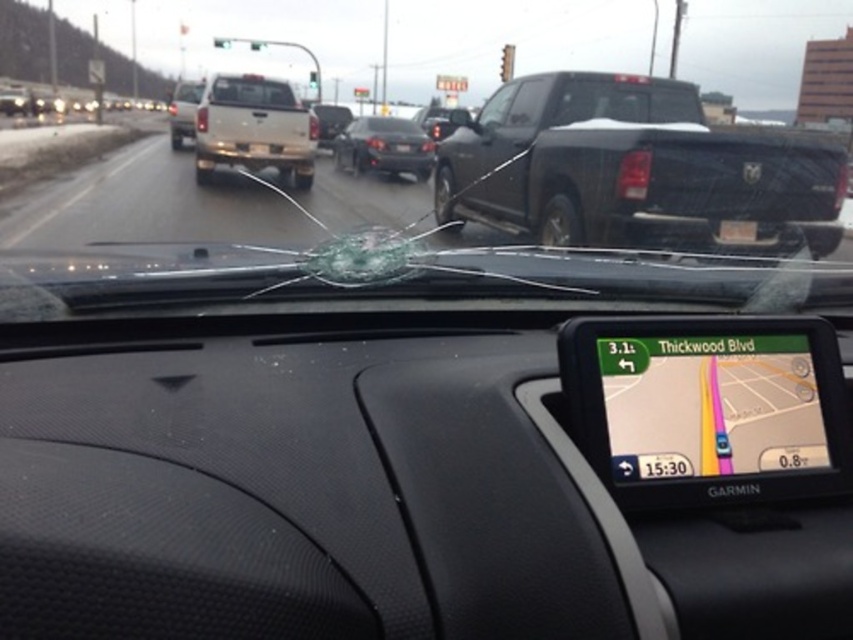
Looking at this image, you are driving and looking at the GPS device on the dashboard. You notice two points marked on the windshield. Which point is closer to you, the driver, between the point at coordinates (233, 148) and the point at coordinates (366, 148)?

The point at coordinates (233, 148) is closer to you because it is in front of the point at coordinates (366, 148).

You are driving and need to make a turn soon. Looking through the windshield, you see a black matte truck at upper right and a matte white truck at upper center. Which truck is positioned more to the right side of your view?

The black matte truck at upper right is positioned more to the right side of your view than the matte white truck at upper center.

You are a driver approaching Thickwood Blvd and see the black matte truck at upper right and the matte white truck at upper center through the windshield. Which truck is positioned higher in the image?

The black matte truck at upper right is positioned higher in the image than the matte white truck at upper center.